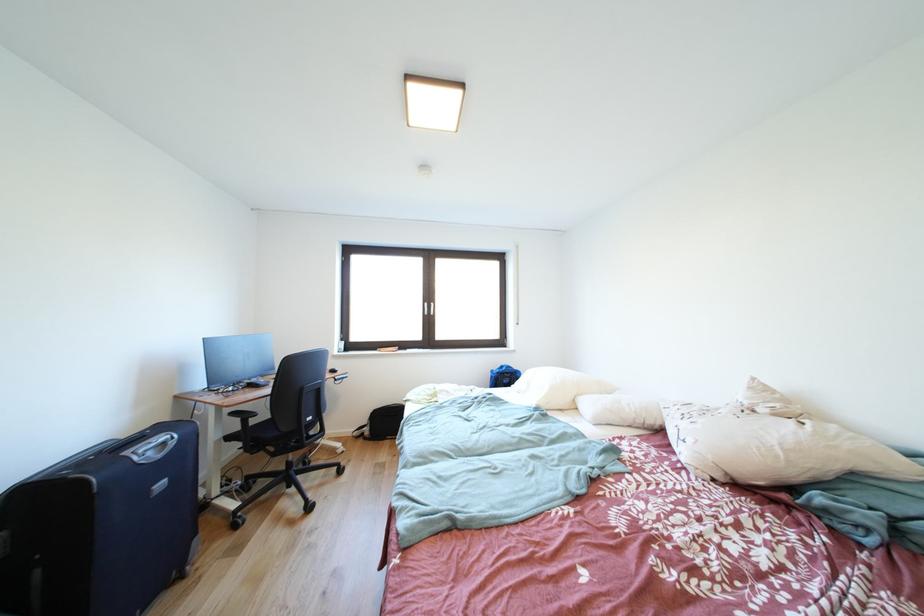
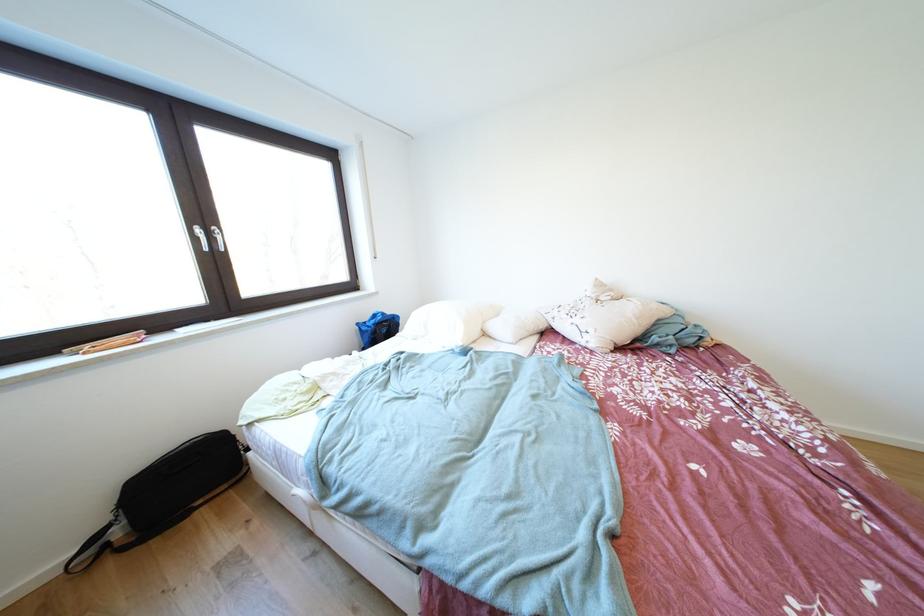
The point at (500, 376) is marked in the first image. Where is the corresponding point in the second image?

(367, 329)